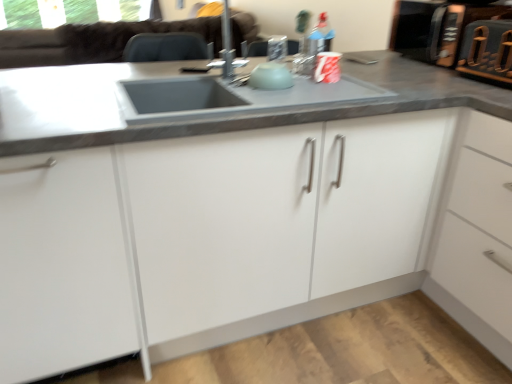
In order to face metallic silver toaster at upper right, should I rotate leftwards or rightwards?

You should look right and rotate roughly 24.260 degrees.

You are a GUI agent. You are given a task and a screenshot of the screen. Output one action in this format:
    pyautogui.click(x=<x>, y=<y>)
    Task: Click on the metallic silver toaster at upper right
    This screenshot has height=384, width=512.
    Given the screenshot: What is the action you would take?
    pyautogui.click(x=436, y=28)

Describe the element at coordinates (436, 28) in the screenshot. I see `metallic silver toaster at upper right` at that location.

Identify the location of white matte cabinet at center. The image size is (512, 384). [220, 234].

Describe the element at coordinates (220, 234) in the screenshot. Image resolution: width=512 pixels, height=384 pixels. I see `white matte cabinet at center` at that location.

I want to click on metallic silver toaster at upper right, so click(436, 28).

Between white matte cabinet at center and metallic silver toaster at upper right, which one appears on the right side from the viewer's perspective?

metallic silver toaster at upper right is more to the right.

Does white matte cabinet at center lie behind metallic silver toaster at upper right?

No, white matte cabinet at center is in front of metallic silver toaster at upper right.

Does point (168, 154) come closer to viewer compared to point (407, 27)?

That is True.

From the image's perspective, which object appears higher, white matte cabinet at center or metallic silver toaster at upper right?

metallic silver toaster at upper right is shown above in the image.

From a real-world perspective, is white matte cabinet at center physically located above or below metallic silver toaster at upper right?

white matte cabinet at center is below metallic silver toaster at upper right.

Is white matte cabinet at center wider or thinner than metallic silver toaster at upper right?

white matte cabinet at center is wider than metallic silver toaster at upper right.

From their relative heights in the image, would you say white matte cabinet at center is taller or shorter than metallic silver toaster at upper right?

white matte cabinet at center is taller than metallic silver toaster at upper right.

Looking at the image, does white matte cabinet at center seem bigger or smaller compared to metallic silver toaster at upper right?

Clearly, white matte cabinet at center is larger in size than metallic silver toaster at upper right.

Is white matte cabinet at center inside or outside of metallic silver toaster at upper right?

The correct answer is: outside.

Is white matte cabinet at center far from metallic silver toaster at upper right?

white matte cabinet at center is actually quite close to metallic silver toaster at upper right.

Is white matte cabinet at center facing towards metallic silver toaster at upper right?

No, white matte cabinet at center is not turned towards metallic silver toaster at upper right.

What's the angular difference between white matte cabinet at center and metallic silver toaster at upper right's facing directions?

The angle between the facing direction of white matte cabinet at center and the facing direction of metallic silver toaster at upper right is 92.3 degrees.

Measure the distance from white matte cabinet at center to metallic silver toaster at upper right.

They are 35.17 inches apart.

The image size is (512, 384). I want to click on appliance located on the right of white matte cabinet at center, so click(436, 28).

Considering the positions of objects metallic silver toaster at upper right and white matte cabinet at center in the image provided, who is more to the left, metallic silver toaster at upper right or white matte cabinet at center?

From the viewer's perspective, white matte cabinet at center appears more on the left side.

Is metallic silver toaster at upper right closer to the viewer compared to white matte cabinet at center?

No, it is not.

Considering the points (411, 52) and (191, 251), which point is in front, point (411, 52) or point (191, 251)?

The point (191, 251) is closer.

From the image's perspective, which is below, metallic silver toaster at upper right or white matte cabinet at center?

From the image's view, white matte cabinet at center is below.

From a real-world perspective, is metallic silver toaster at upper right above or below white matte cabinet at center?

Clearly, from a real-world perspective, metallic silver toaster at upper right is above white matte cabinet at center.

Is metallic silver toaster at upper right thinner than white matte cabinet at center?

Indeed, metallic silver toaster at upper right has a lesser width compared to white matte cabinet at center.

From the picture: Which of these two, metallic silver toaster at upper right or white matte cabinet at center, stands shorter?

metallic silver toaster at upper right.

Who is bigger, metallic silver toaster at upper right or white matte cabinet at center?

white matte cabinet at center.

Consider the image. Is metallic silver toaster at upper right inside or outside of white matte cabinet at center?

metallic silver toaster at upper right cannot be found inside white matte cabinet at center.

Is metallic silver toaster at upper right not close to white matte cabinet at center?

They are positioned close to each other.

Is metallic silver toaster at upper right turned away from white matte cabinet at center?

metallic silver toaster at upper right does not have its back to white matte cabinet at center.

The image size is (512, 384). In order to click on appliance that appears above the white matte cabinet at center (from the image's perspective) in this screenshot , I will do `click(436, 28)`.

Locate an element on the screen. The image size is (512, 384). cabinetry in front of the metallic silver toaster at upper right is located at coordinates (220, 234).

At what (x,y) coordinates should I click in order to perform the action: click on appliance above the white matte cabinet at center (from the image's perspective). Please return your answer as a coordinate pair (x, y). Looking at the image, I should click on (436, 28).